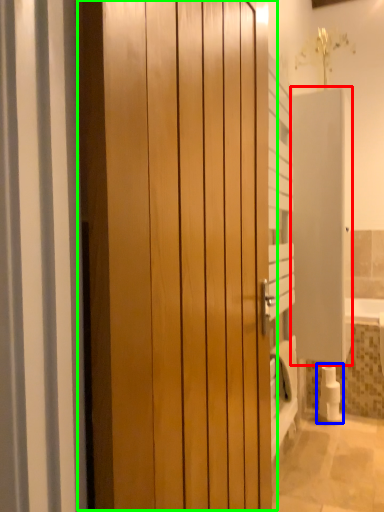
Question: Based on their relative distances, which object is farther from screen door (highlighted by a red box)? Choose from toilet paper (highlighted by a blue box) and door (highlighted by a green box).

Choices:
 (A) toilet paper
 (B) door

Answer: (B)